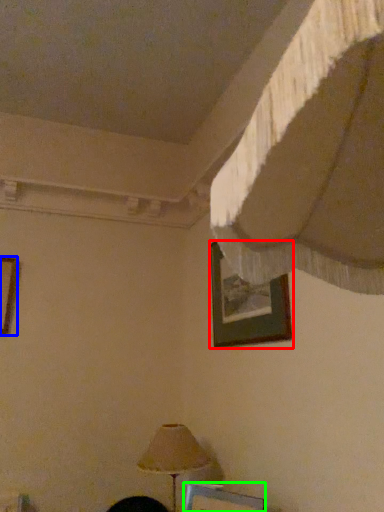
Question: Estimate the real-world distances between objects in this image. Which object is farther from picture frame (highlighted by a red box), picture frame (highlighted by a blue box) or picture frame (highlighted by a green box)?

Choices:
 (A) picture frame
 (B) picture frame

Answer: (A)